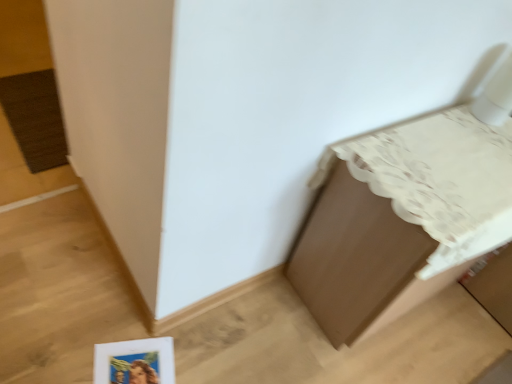
You are a GUI agent. You are given a task and a screenshot of the screen. Output one action in this format:
    pyautogui.click(x=<x>, y=<y>)
    Task: Click on the vacant point to the right of brown matte cabinet at upper right
    
    Given the screenshot: What is the action you would take?
    pyautogui.click(x=463, y=337)